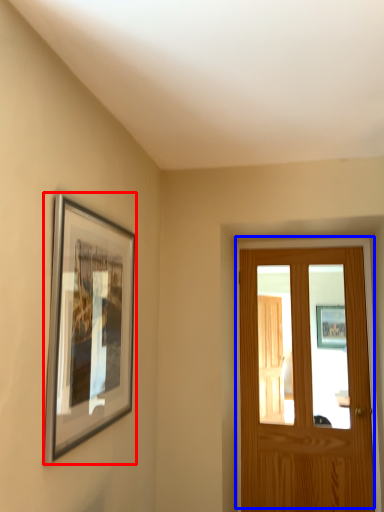
Question: Among these objects, which one is farthest to the camera, picture frame (highlighted by a red box) or door (highlighted by a blue box)?

Choices:
 (A) picture frame
 (B) door

Answer: (B)